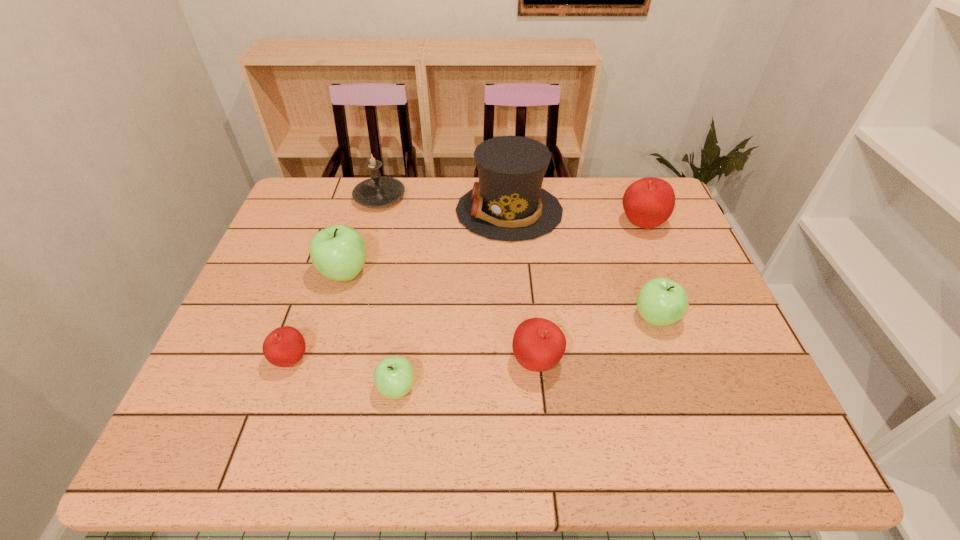
Select which green apple appears as the closest to the leftmost red apple. Please provide its 2D coordinates. Your answer should be formatted as a tuple, i.e. [(x, y)], where the tuple contains the x and y coordinates of a point satisfying the conditions above.

[(339, 252)]

The height and width of the screenshot is (540, 960). What are the coordinates of `vacant area that satisfies the following two spatial constraints: 1. with goggles on the front of the second biggest red apple; 2. on the left side of the dress hat` in the screenshot? It's located at (520, 362).

This screenshot has width=960, height=540. In order to click on vacant space that satisfies the following two spatial constraints: 1. with goggles on the front of the dress hat; 2. on the front side of the leftmost red apple in this screenshot , I will do `click(520, 360)`.

The image size is (960, 540). Identify the location of vacant space that satisfies the following two spatial constraints: 1. on the front side of the smallest green apple; 2. on the right side of the leftmost green apple. (311, 388).

The width and height of the screenshot is (960, 540). I want to click on free space in the image that satisfies the following two spatial constraints: 1. with goggles on the front of the second smallest red apple; 2. on the left side of the dress hat, so click(520, 362).

Image resolution: width=960 pixels, height=540 pixels. Find the location of `vacant space that satisfies the following two spatial constraints: 1. with goggles on the front of the tallest object; 2. on the right side of the farthest red apple`. vacant space that satisfies the following two spatial constraints: 1. with goggles on the front of the tallest object; 2. on the right side of the farthest red apple is located at coordinates (510, 225).

This screenshot has height=540, width=960. In order to click on free space in the image that satisfies the following two spatial constraints: 1. on the front side of the second red apple from left to right; 2. on the left side of the leftmost red apple in this screenshot , I will do `click(290, 362)`.